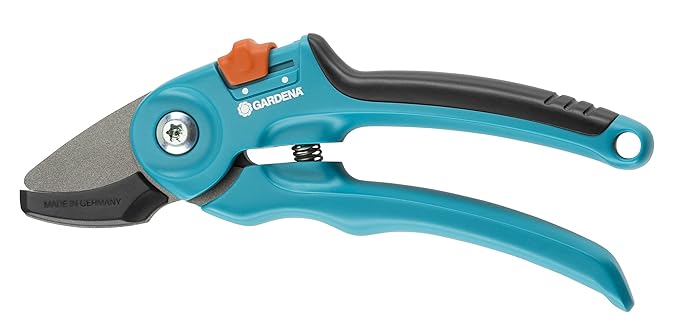
At what (x,y) coordinates should I click in order to perform the action: click on lock. Please return your answer as a coordinate pair (x, y). Looking at the image, I should click on (246, 63).